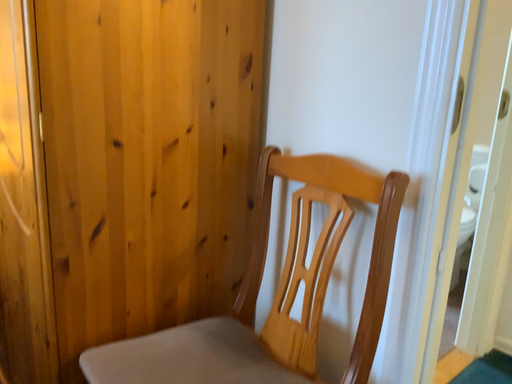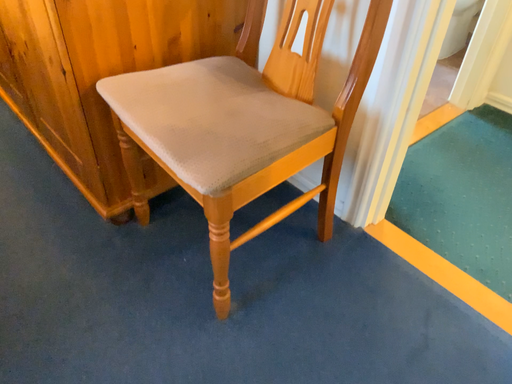
Question: Which way did the camera rotate in the video?

Choices:
 (A) rotated downward
 (B) rotated upward

Answer: (A)